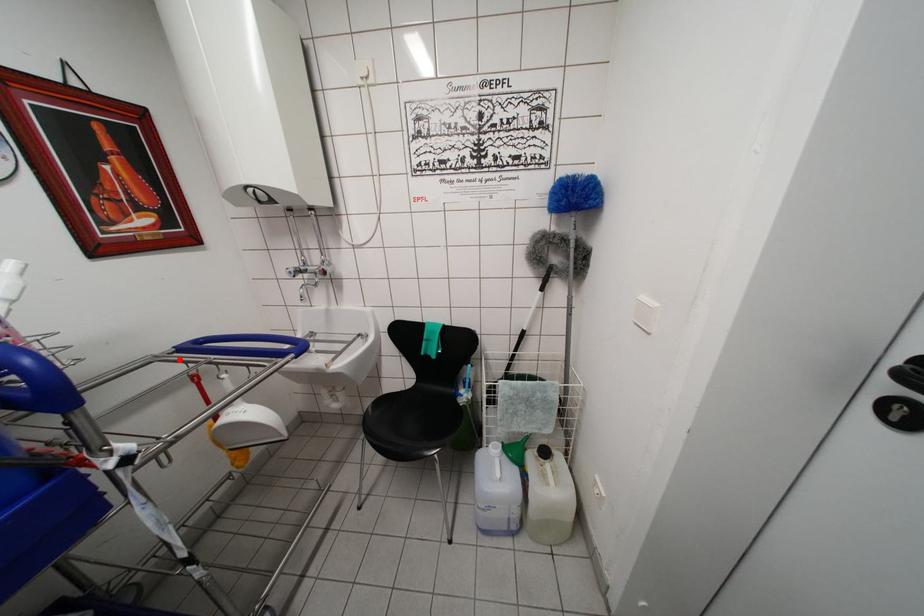
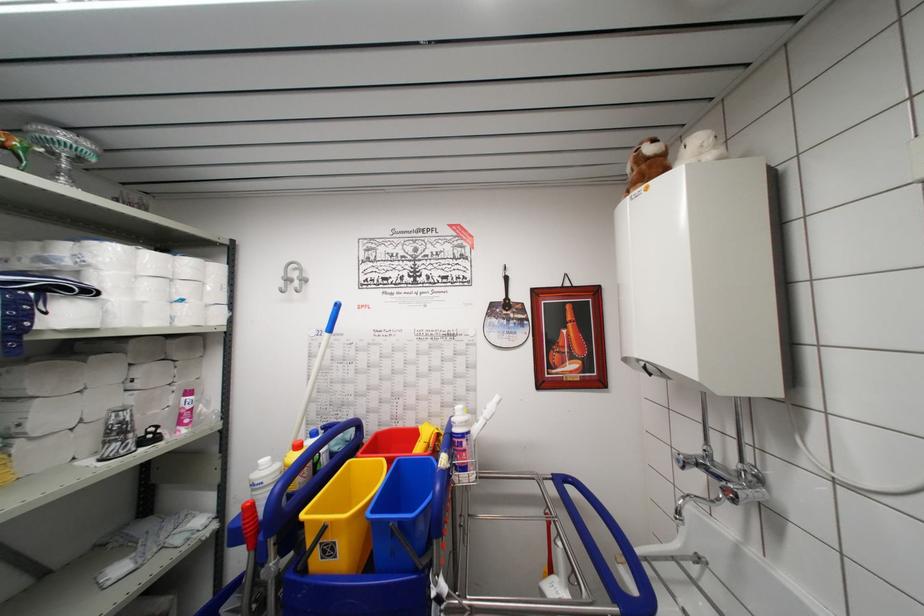
Question: I am providing you with two images of the same scene from different viewpoints. A red point is marked on the first image. Can you still see the location of the red point in image 2?

Choices:
 (A) Yes
 (B) No

Answer: (A)